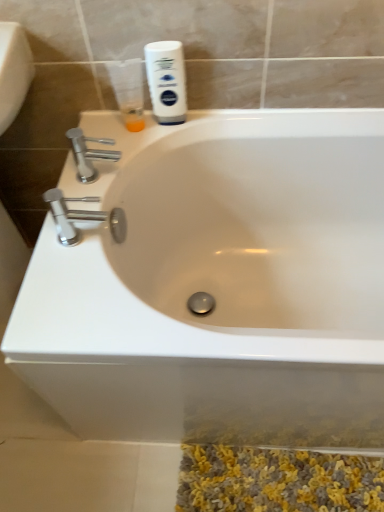
Question: Considering their positions, is white matte shaving cream at upper center located in front of or behind chrome metallic faucet at left, marked as the first tap in a bottom-to-top arrangement?

Choices:
 (A) front
 (B) behind

Answer: (B)

Question: In terms of width, does white matte shaving cream at upper center look wider or thinner when compared to chrome metallic faucet at left, marked as the first tap in a bottom-to-top arrangement?

Choices:
 (A) wide
 (B) thin

Answer: (B)

Question: Which of these objects is positioned farthest from the white matte shaving cream at upper center?

Choices:
 (A) polished chrome faucet at upper left, the 2th tap viewed from the front
 (B) white glossy bathtub at center
 (C) chrome metallic faucet at left, the second tap when ordered from top to bottom
 (D) translucent plastic cup at upper left

Answer: (B)

Question: Which object is the closest to the white glossy bathtub at center?

Choices:
 (A) chrome metallic faucet at left, acting as the first tap starting from the front
 (B) polished chrome faucet at upper left, the 2th tap viewed from the front
 (C) translucent plastic cup at upper left
 (D) white matte shaving cream at upper center

Answer: (A)